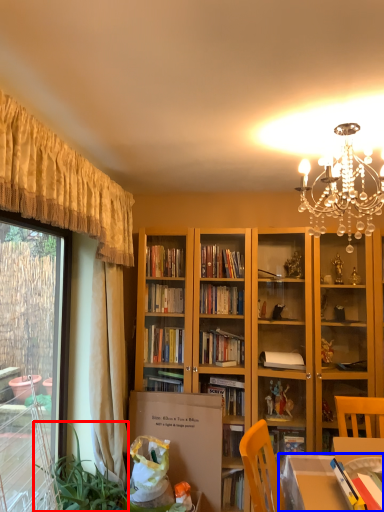
Question: Which object is further to the camera taking this photo, plant (highlighted by a red box) or table (highlighted by a blue box)?

Choices:
 (A) plant
 (B) table

Answer: (A)